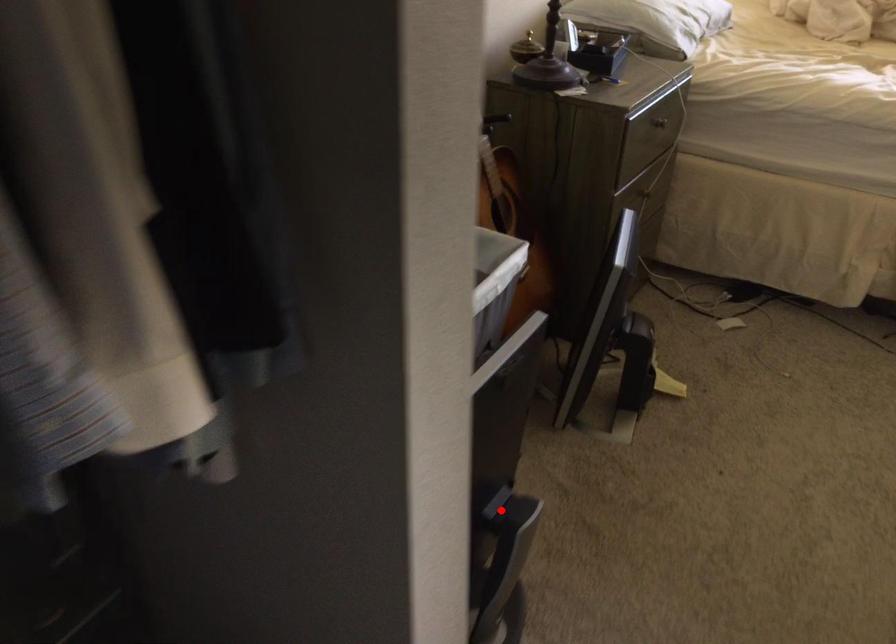
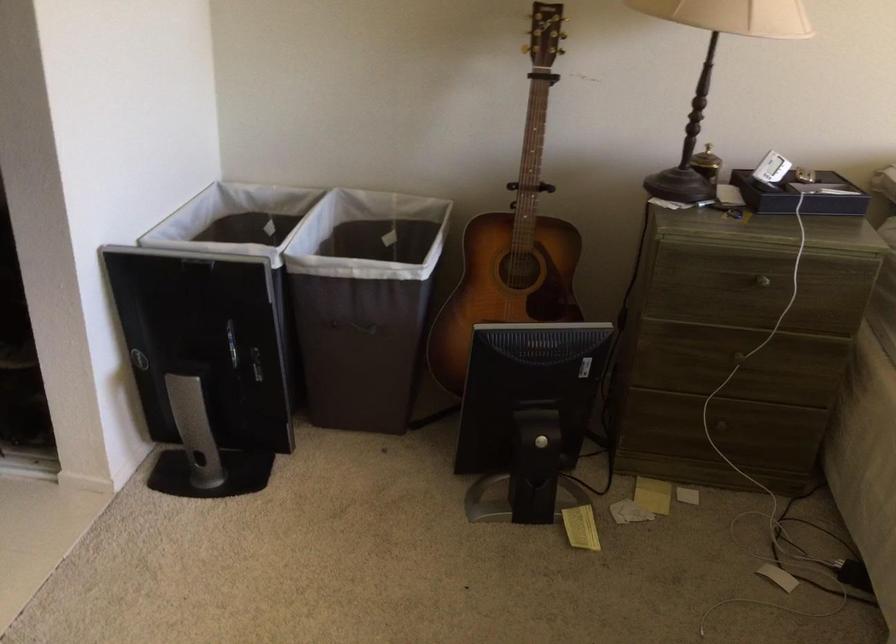
Where in the second image is the point corresponding to the highlighted location from the first image?

(203, 365)